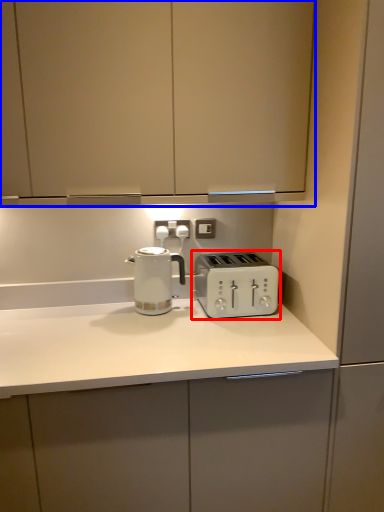
Question: Which of the following is the closest to the observer, toaster (highlighted by a red box) or cabinetry (highlighted by a blue box)?

Choices:
 (A) toaster
 (B) cabinetry

Answer: (B)